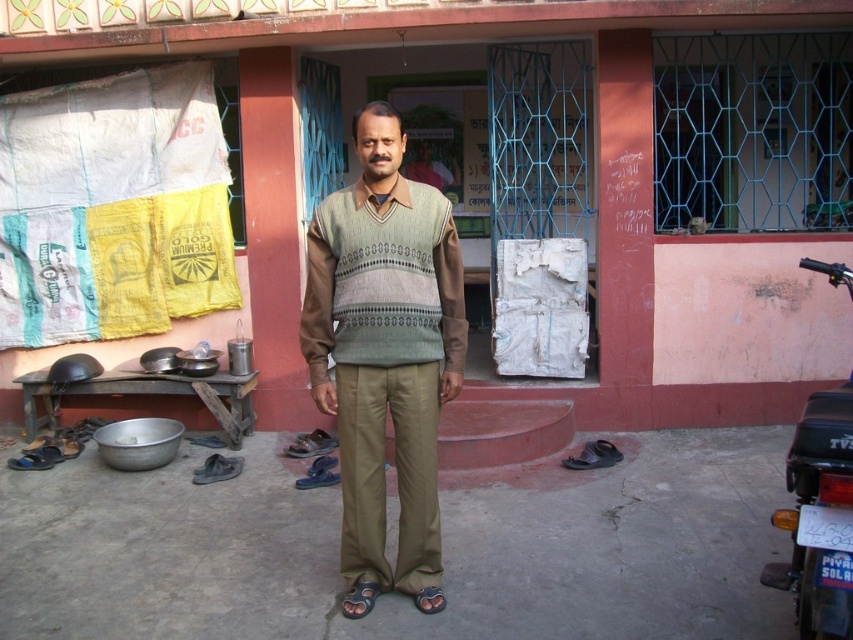
Question: Is knitted sweater at center closer to the viewer compared to black matte motorcycle at right?

Choices:
 (A) yes
 (B) no

Answer: (B)

Question: In this image, where is knitted sweater at center located relative to black matte motorcycle at right?

Choices:
 (A) right
 (B) left

Answer: (B)

Question: Which object is positioned closest to the knitted beige sweater at center?

Choices:
 (A) black matte motorcycle at right
 (B) knitted sweater at center

Answer: (B)

Question: Considering the real-world distances, which object is farthest from the knitted beige sweater at center?

Choices:
 (A) knitted sweater at center
 (B) black matte motorcycle at right

Answer: (B)

Question: Which of these objects is positioned closest to the black matte motorcycle at right?

Choices:
 (A) knitted beige sweater at center
 (B) knitted sweater at center

Answer: (B)

Question: Does knitted sweater at center have a lesser width compared to black matte motorcycle at right?

Choices:
 (A) yes
 (B) no

Answer: (B)